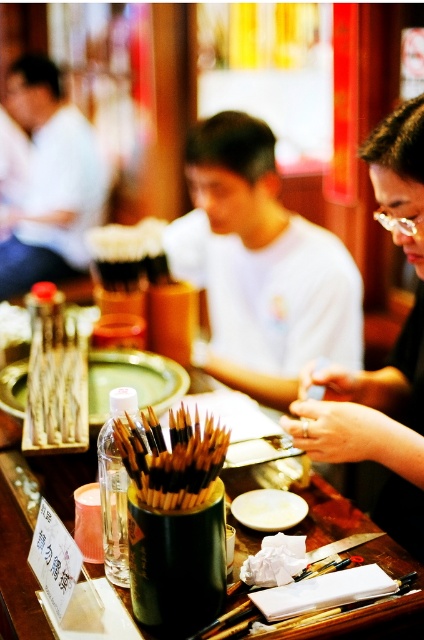
Question: Which point appears farthest from the camera in this image?

Choices:
 (A) (105, 355)
 (B) (63, 173)
 (C) (412, 173)

Answer: (B)

Question: Among these objects, which one is nearest to the camera?

Choices:
 (A) matte black hair at center
 (B) white ceramic plate at center
 (C) wooden platter at center
 (D) matte white shirt at center

Answer: (A)

Question: Is wooden table at center smaller than wooden platter at center?

Choices:
 (A) yes
 (B) no

Answer: (B)

Question: Does matte white shirt at center lie behind wooden platter at center?

Choices:
 (A) yes
 (B) no

Answer: (A)

Question: Can you confirm if matte white shirt at center is smaller than matte black hair at center?

Choices:
 (A) no
 (B) yes

Answer: (A)

Question: Which object is positioned farthest from the white ceramic plate at center?

Choices:
 (A) matte white shirt at center
 (B) wooden table at center
 (C) wooden platter at center
 (D) matte white shirt at upper left

Answer: (D)